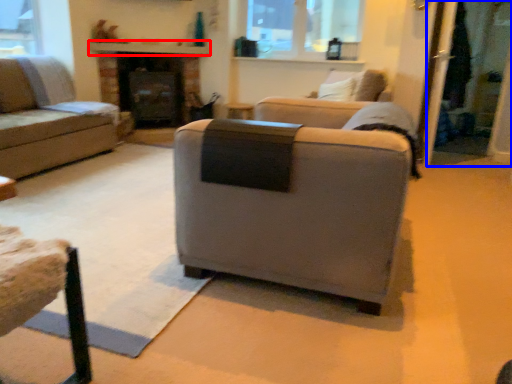
Question: Which object is further to the camera taking this photo, mantle (highlighted by a red box) or screen door (highlighted by a blue box)?

Choices:
 (A) mantle
 (B) screen door

Answer: (A)